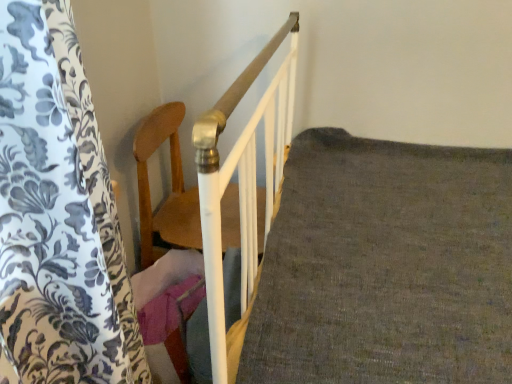
What do you see at coordinates (385, 266) in the screenshot?
I see `floral cotton blanket at lower left` at bounding box center [385, 266].

Measure the distance between point (312, 374) and camera.

Point (312, 374) is 26.42 inches away from camera.

What are the coordinates of `floral cotton blanket at lower left` in the screenshot? It's located at (x=385, y=266).

At what (x,y) coordinates should I click in order to perform the action: click on floral cotton blanket at lower left. Please return your answer as a coordinate pair (x, y). Looking at the image, I should click on (385, 266).